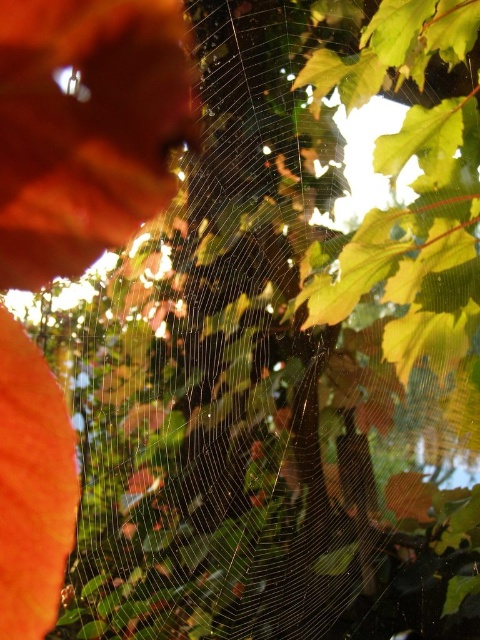
Question: Among these points, which one is nearest to the camera?

Choices:
 (A) (49, 451)
 (B) (72, 221)

Answer: (A)

Question: Does matte orange leaf at upper left have a greater width compared to orange matte leaf at left?

Choices:
 (A) no
 (B) yes

Answer: (B)

Question: Which point appears closest to the camera in this image?

Choices:
 (A) (11, 424)
 (B) (172, 140)

Answer: (A)

Question: Can you confirm if matte orange leaf at upper left is bigger than orange matte leaf at left?

Choices:
 (A) yes
 (B) no

Answer: (A)

Question: Does matte orange leaf at upper left have a smaller size compared to orange matte leaf at left?

Choices:
 (A) no
 (B) yes

Answer: (A)